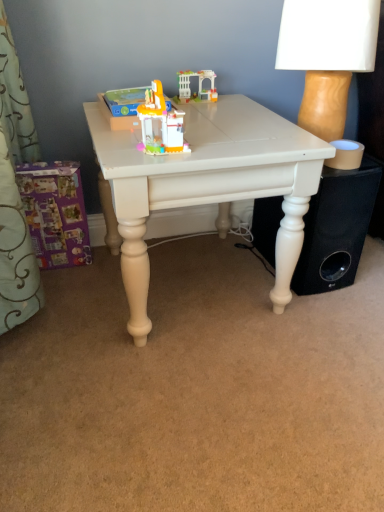
Find the location of a particular element. The height and width of the screenshot is (512, 384). free spot to the right of translucent plastic toy at center, arranged as the 3th toy when ordered from the bottom is located at coordinates (201, 110).